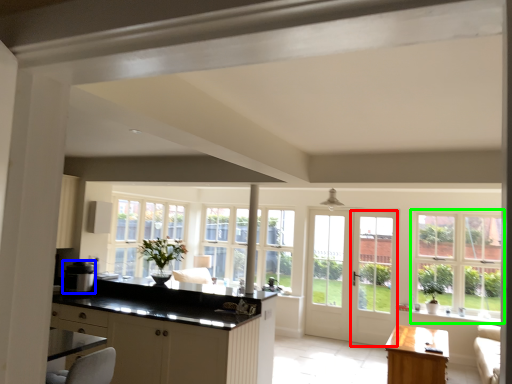
Question: Which object is the farthest from screen door (highlighted by a red box)? Choose among these: appliance (highlighted by a blue box) or window (highlighted by a green box).

Choices:
 (A) appliance
 (B) window

Answer: (A)